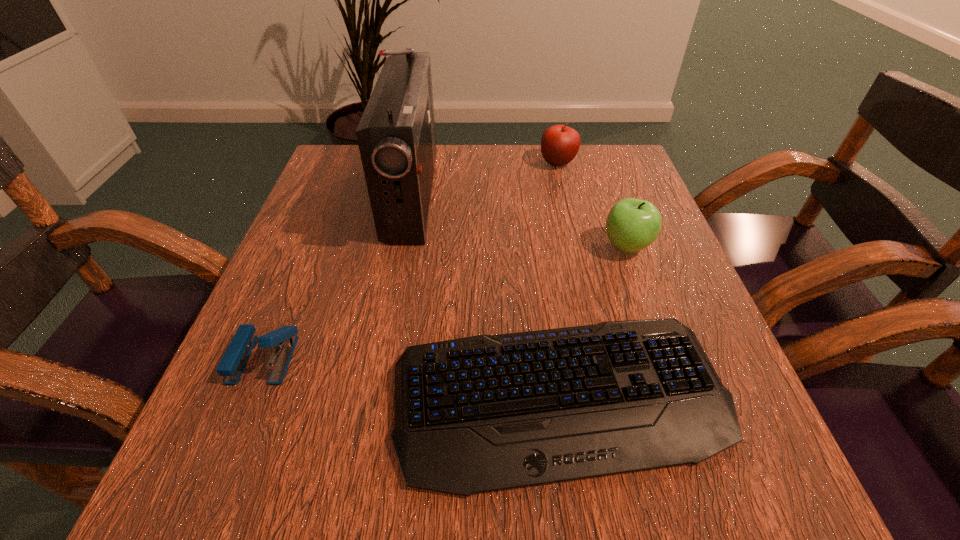
Find the location of a particular element. vacant space that is in between the computer keyboard and the farther apple is located at coordinates (559, 281).

This screenshot has height=540, width=960. In order to click on vacant area that lies between the radio receiver and the stapler in this screenshot , I will do `click(338, 276)`.

You are a GUI agent. You are given a task and a screenshot of the screen. Output one action in this format:
    pyautogui.click(x=<x>, y=<y>)
    Task: Click on the object identified as the third closest to the nearer apple
    The height and width of the screenshot is (540, 960).
    Given the screenshot: What is the action you would take?
    pyautogui.click(x=396, y=136)

Identify which object is the closest to the stapler. Please provide its 2D coordinates. Your answer should be formatted as a tuple, i.e. [(x, y)], where the tuple contains the x and y coordinates of a point satisfying the conditions above.

[(483, 413)]

Where is `free spot that satisfies the following two spatial constraints: 1. on the front-facing side of the tallest object; 2. on the left side of the nearer apple`? free spot that satisfies the following two spatial constraints: 1. on the front-facing side of the tallest object; 2. on the left side of the nearer apple is located at coordinates (402, 246).

The width and height of the screenshot is (960, 540). What are the coordinates of `free location that satisfies the following two spatial constraints: 1. on the back side of the shortest object; 2. on the right side of the nearer apple` in the screenshot? It's located at (539, 246).

Locate an element on the screen. The height and width of the screenshot is (540, 960). vacant space that satisfies the following two spatial constraints: 1. on the front-facing side of the computer keyboard; 2. on the left side of the tallest object is located at coordinates (373, 400).

Identify the location of vacant point that satisfies the following two spatial constraints: 1. on the back side of the nearer apple; 2. on the front-facing side of the tallest object. Image resolution: width=960 pixels, height=540 pixels. 609,195.

The height and width of the screenshot is (540, 960). In order to click on vacant point that satisfies the following two spatial constraints: 1. on the front-facing side of the shortest object; 2. on the left side of the tallest object in this screenshot , I will do `click(373, 400)`.